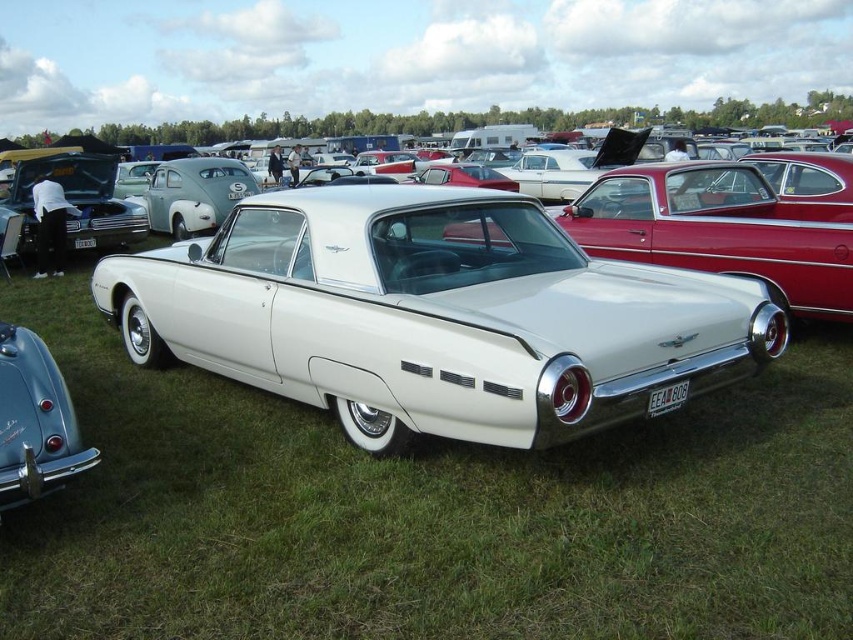
Question: Which object is closer to the camera taking this photo?

Choices:
 (A) shiny chrome bumper at lower left
 (B) white glossy car at center

Answer: (A)

Question: Can you confirm if white glossy car at center is positioned above shiny chrome bumper at lower left?

Choices:
 (A) yes
 (B) no

Answer: (A)

Question: Among these objects, which one is farthest from the camera?

Choices:
 (A) shiny chrome bumper at lower left
 (B) white glossy car at center

Answer: (B)

Question: Can you confirm if white glossy car at center is wider than shiny chrome bumper at lower left?

Choices:
 (A) no
 (B) yes

Answer: (B)

Question: Does white glossy car at center appear over shiny chrome bumper at lower left?

Choices:
 (A) no
 (B) yes

Answer: (B)